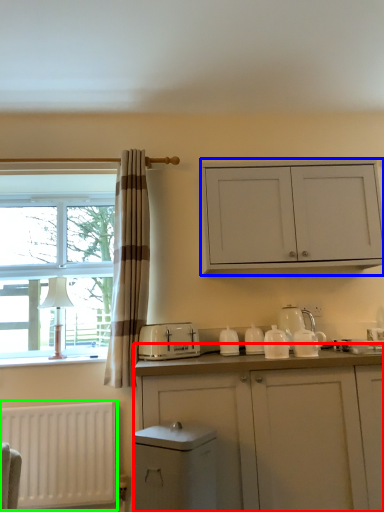
Question: Which object is positioned closest to cabinetry (highlighted by a red box)? Select from cabinetry (highlighted by a blue box) and radiator (highlighted by a green box).

Choices:
 (A) cabinetry
 (B) radiator

Answer: (A)